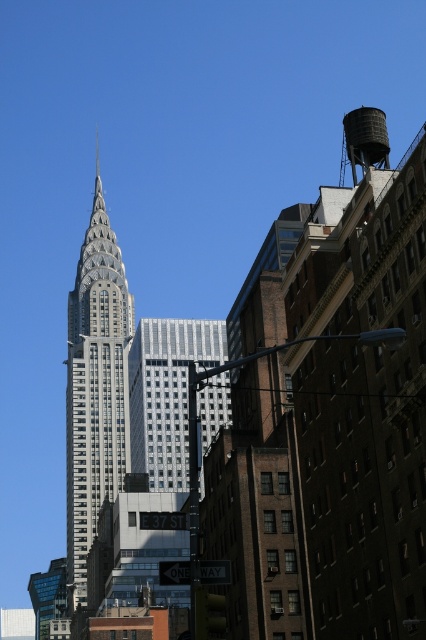
Is gray stone tower at center shorter than silver glass building at center?

Incorrect, gray stone tower at center's height does not fall short of silver glass building at center's.

Is point (118, 400) positioned after point (215, 349)?

Yes, it is.

The image size is (426, 640). I want to click on gray stone tower at center, so click(x=95, y=388).

You are a GUI agent. You are given a task and a screenshot of the screen. Output one action in this format:
    pyautogui.click(x=<x>, y=<y>)
    Task: Click on the gray stone tower at center
    This screenshot has height=640, width=426.
    Given the screenshot: What is the action you would take?
    pyautogui.click(x=95, y=388)

The width and height of the screenshot is (426, 640). I want to click on silver glass building at center, so click(166, 394).

Between gray stone tower at center and matte gray water tower at upper right, which one appears on the right side from the viewer's perspective?

matte gray water tower at upper right

Who is more distant from viewer, (74, 576) or (368, 163)?

Point (74, 576)

I want to click on gray stone tower at center, so click(95, 388).